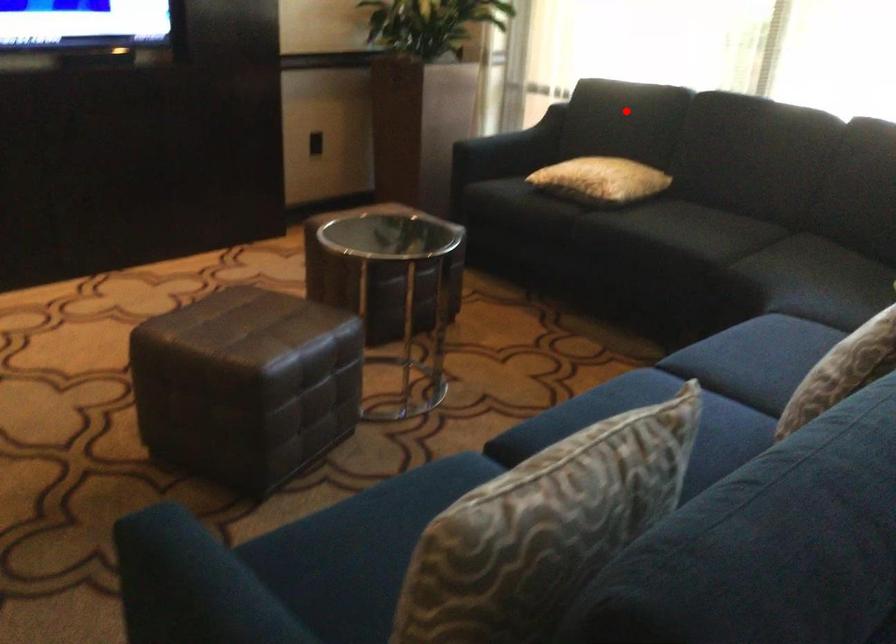
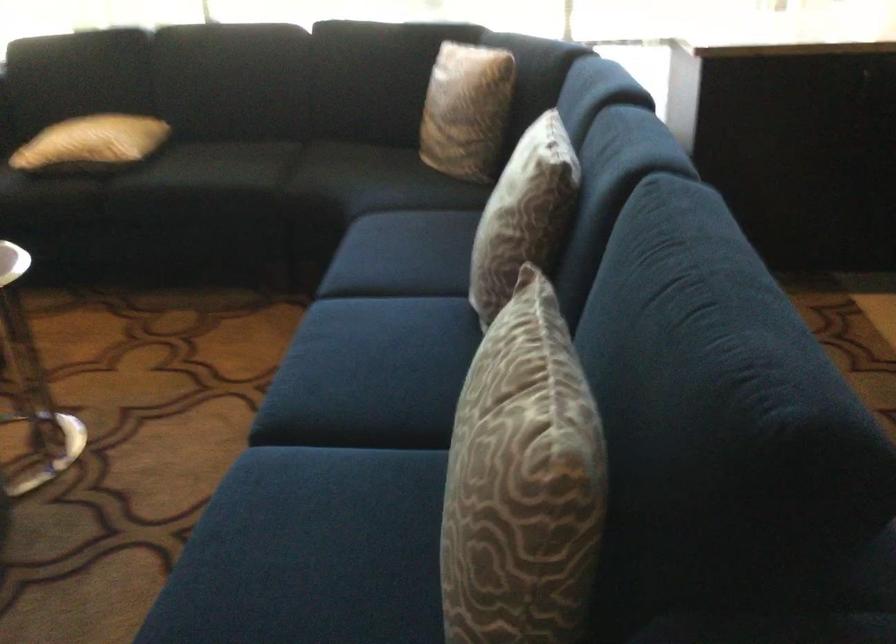
Question: A red point is marked in image1. In image2, is the corresponding 3D point closer to the camera or farther? Reply with the corresponding letter.

Choices:
 (A) The corresponding 3D point is closer.
 (B) The corresponding 3D point is farther.

Answer: (A)